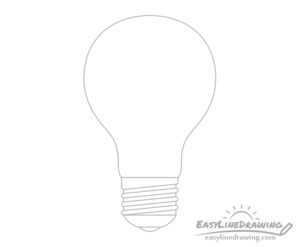
This screenshot has width=300, height=247. In order to click on empty space to the left of bulb in this screenshot , I will do `click(91, 148)`.